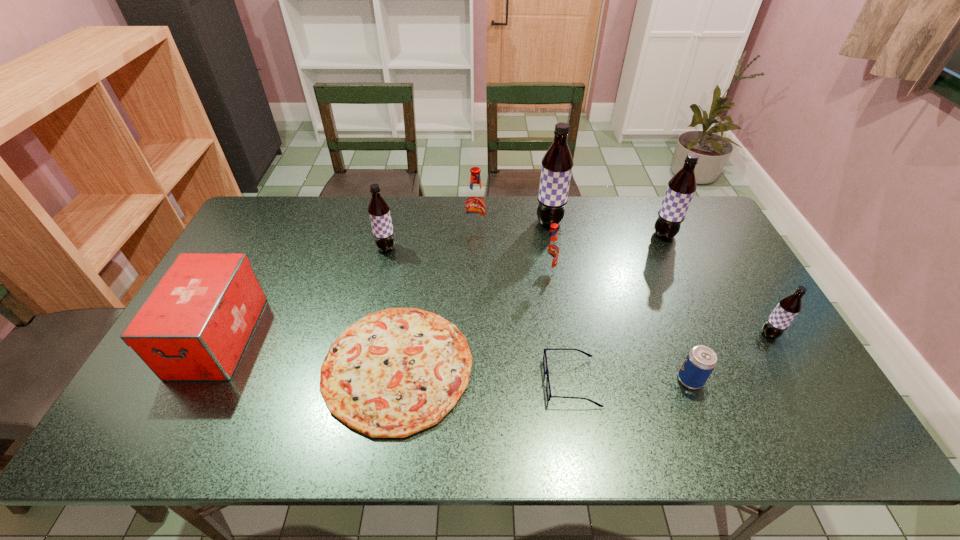
This screenshot has height=540, width=960. I want to click on the nearest root beer, so pos(788,307).

The height and width of the screenshot is (540, 960). Find the location of `the rightmost root beer`. the rightmost root beer is located at coordinates (788, 307).

Identify the location of the leftmost object. This screenshot has width=960, height=540. (194, 325).

The image size is (960, 540). I want to click on beer can, so click(700, 362).

Identify the location of the eighth tallest object. This screenshot has width=960, height=540. (700, 362).

You are a GUI agent. You are given a task and a screenshot of the screen. Output one action in this format:
    pyautogui.click(x=<x>, y=<y>)
    Task: Click on the second shortest object
    
    Given the screenshot: What is the action you would take?
    pyautogui.click(x=548, y=389)

Find the location of a particular element. This screenshot has height=540, width=960. the shortest object is located at coordinates (395, 372).

The image size is (960, 540). What are the coordinates of `vacant space located on the right of the biggest brown root beer` in the screenshot? It's located at point(589,222).

Where is `vacant region located 0.080m on the back of the second tallest root beer`? The image size is (960, 540). vacant region located 0.080m on the back of the second tallest root beer is located at coordinates (654, 213).

Where is `vacant space located on the left of the bigger red root beer`? vacant space located on the left of the bigger red root beer is located at coordinates (361, 230).